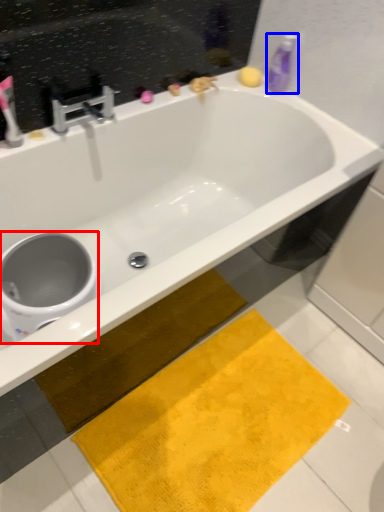
Question: Which object appears farthest to the camera in this image, toilet bowl (highlighted by a red box) or cleaning product (highlighted by a blue box)?

Choices:
 (A) toilet bowl
 (B) cleaning product

Answer: (B)